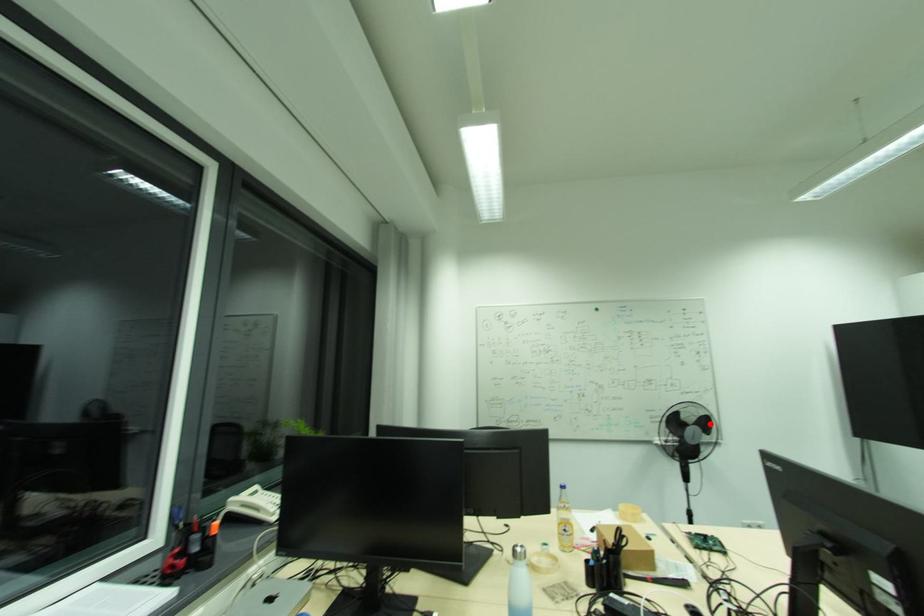
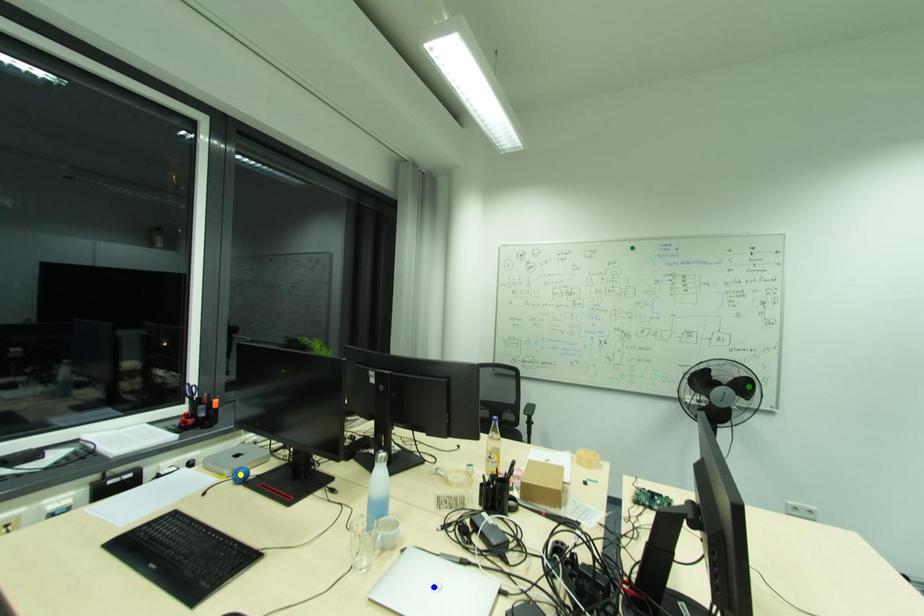
Question: I am providing you with two images of the same scene from different viewpoints. A red point is marked on the first image. You are given multiple points on the second image. In image 2, which mark is for the same physical point as the one in image 1?

Choices:
 (A) blue point
 (B) green point
 (C) yellow point

Answer: (B)